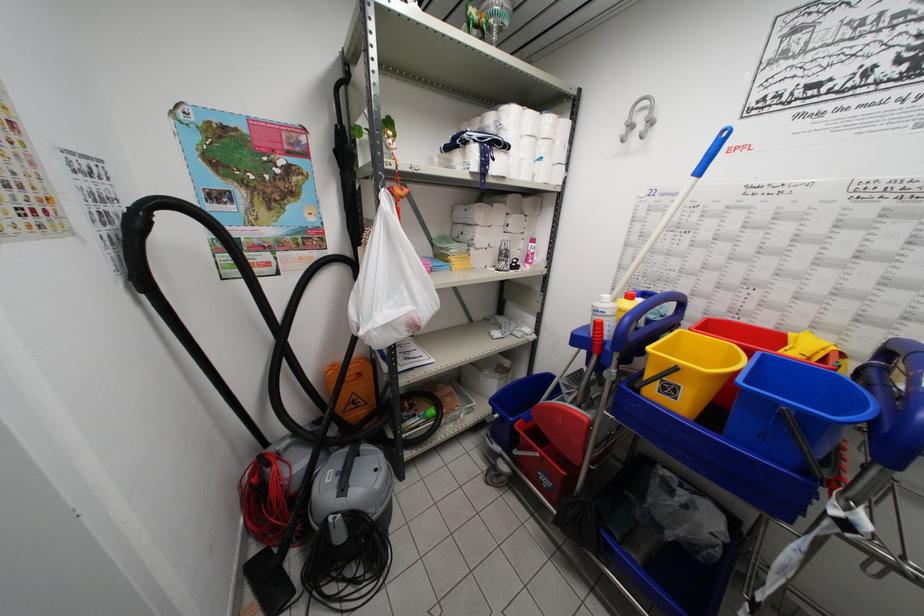
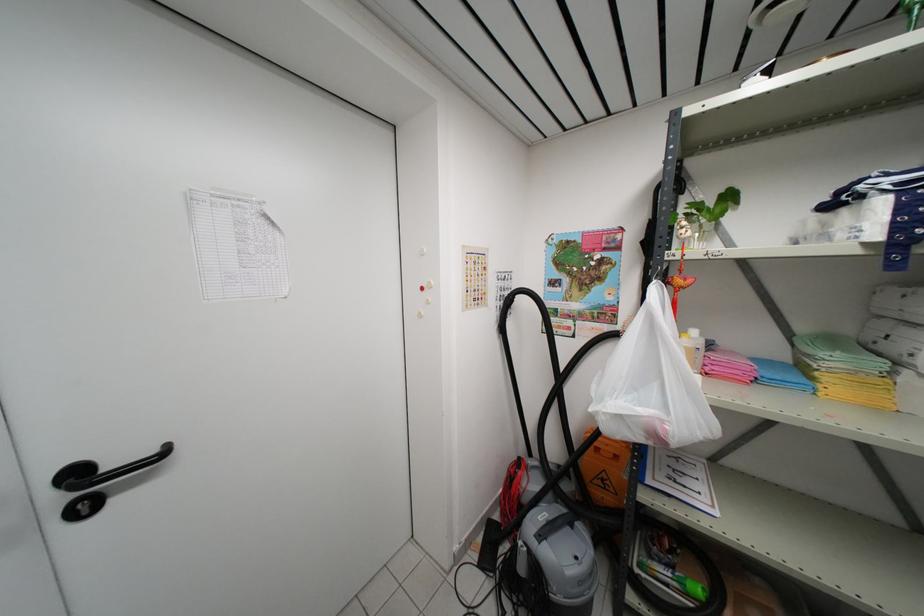
Question: The images are taken continuously from a first-person perspective. In which direction is your viewpoint rotating?

Choices:
 (A) Left
 (B) Right
 (C) Up
 (D) Down

Answer: (A)